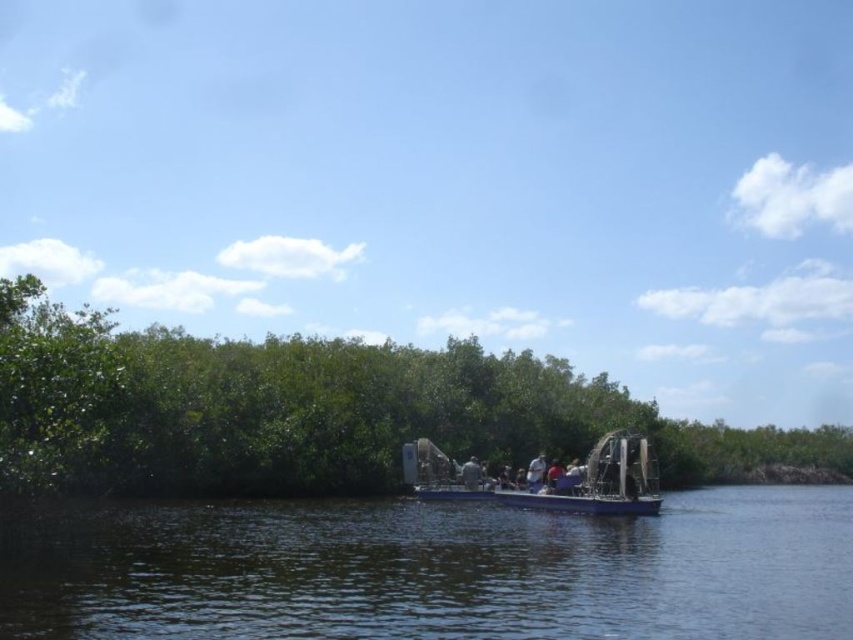
Question: Is dark blue water at center to the left of blue fabric shirt at center from the viewer's perspective?

Choices:
 (A) no
 (B) yes

Answer: (B)

Question: Does dark blue water at center have a greater width compared to blue fabric shirt at center?

Choices:
 (A) yes
 (B) no

Answer: (A)

Question: Is dark blue water at center thinner than light brown leather jacket at center?

Choices:
 (A) no
 (B) yes

Answer: (A)

Question: Which point is closer to the camera?

Choices:
 (A) (416, 604)
 (B) (373, 422)
 (C) (544, 481)

Answer: (A)

Question: Which point appears farthest from the camera in this image?

Choices:
 (A) (547, 481)
 (B) (613, 474)
 (C) (535, 483)
 (D) (668, 534)

Answer: (C)

Question: Which is farther from the blue fabric shirt at center?

Choices:
 (A) blue plastic boat at center
 (B) green leafy trees at center
 (C) light brown leather jacket at center
 (D) dark blue water at center

Answer: (B)